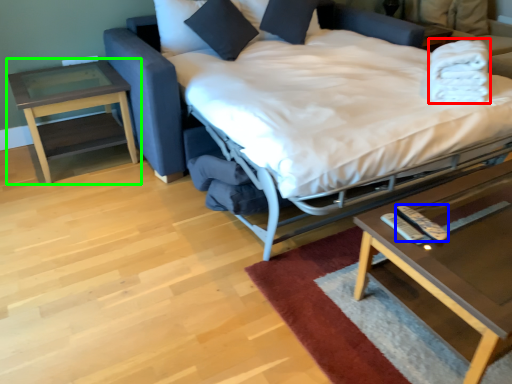
Question: Considering the real-world distances, which object is closest to blanket (highlighted by a red box)? remote (highlighted by a blue box) or table (highlighted by a green box).

Choices:
 (A) remote
 (B) table

Answer: (A)